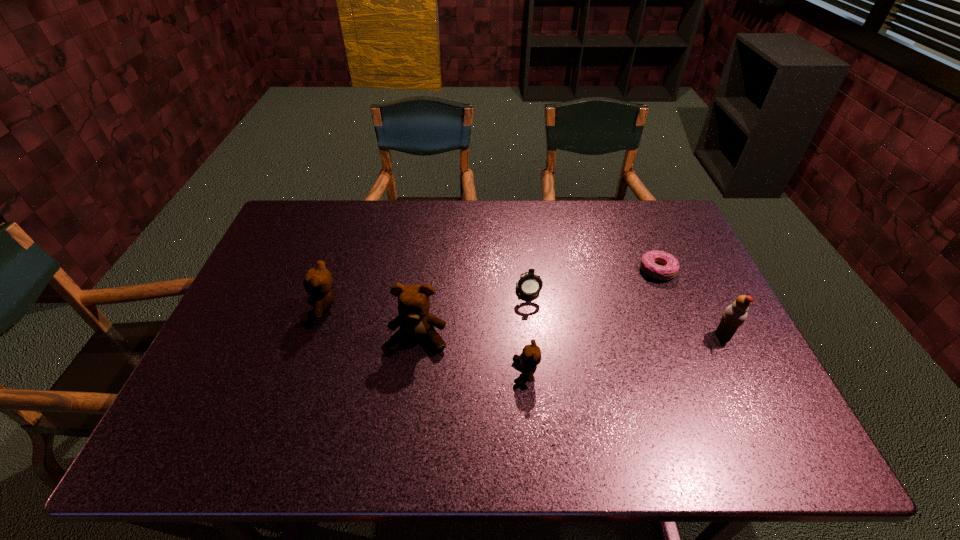
Where is `vacant area that lies between the fifth object from right to left and the leftmost teddy bear`? vacant area that lies between the fifth object from right to left and the leftmost teddy bear is located at coordinates 371,323.

Point out which object is positioned as the fifth nearest to the compass. Please provide its 2D coordinates. Your answer should be formatted as a tuple, i.e. [(x, y)], where the tuple contains the x and y coordinates of a point satisfying the conditions above.

[(318, 281)]

Identify which object is the third closest to the rightmost teddy bear. Please provide its 2D coordinates. Your answer should be formatted as a tuple, i.e. [(x, y)], where the tuple contains the x and y coordinates of a point satisfying the conditions above.

[(669, 270)]

Where is `the third closest teddy bear to the compass`? Image resolution: width=960 pixels, height=540 pixels. the third closest teddy bear to the compass is located at coordinates (318, 281).

Locate which teddy bear ranks second in proximity to the shortest teddy bear. Please provide its 2D coordinates. Your answer should be formatted as a tuple, i.e. [(x, y)], where the tuple contains the x and y coordinates of a point satisfying the conditions above.

[(318, 281)]

This screenshot has height=540, width=960. In order to click on free location that satisfies the following two spatial constraints: 1. on the face of the compass; 2. on the front-facing side of the leftmost teddy bear in this screenshot , I will do `click(530, 308)`.

Locate an element on the screen. vacant region that satisfies the following two spatial constraints: 1. on the face of the compass; 2. on the front-facing side of the second shortest teddy bear is located at coordinates (530, 308).